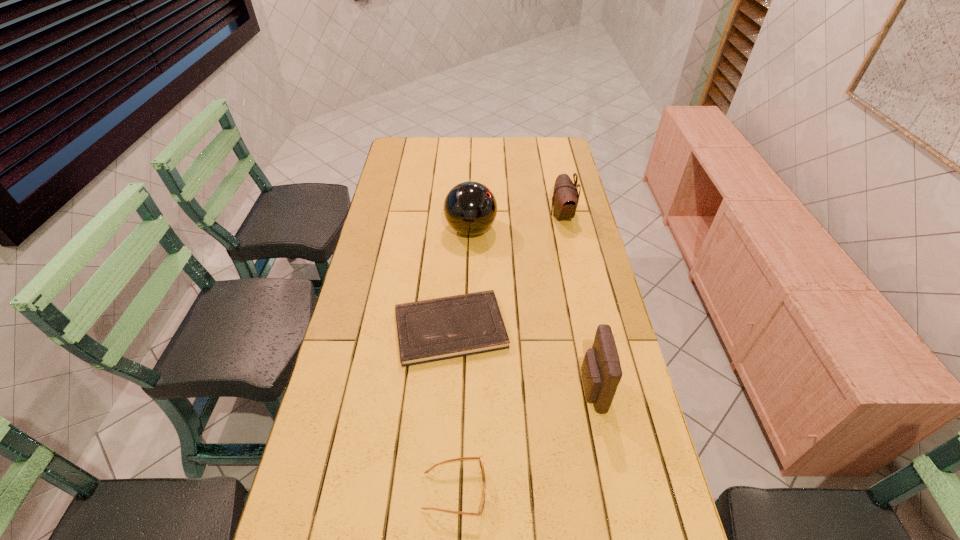
What are the coordinates of `empty space between the farther pouch and the bowling ball` in the screenshot? It's located at pos(516,222).

Image resolution: width=960 pixels, height=540 pixels. What are the coordinates of `vacant space in between the bowling ball and the farther pouch` in the screenshot? It's located at (516, 222).

Where is `free area in between the farther pouch and the bowling ball`? This screenshot has height=540, width=960. free area in between the farther pouch and the bowling ball is located at coordinates (516, 222).

Locate an element on the screen. The height and width of the screenshot is (540, 960). free space between the shortest object and the farther pouch is located at coordinates (506, 272).

Identify the location of free space between the bowling ball and the nearest object. (463, 360).

The width and height of the screenshot is (960, 540). I want to click on vacant area that lies between the nearer pouch and the farther pouch, so click(577, 302).

This screenshot has width=960, height=540. I want to click on free space between the nearer pouch and the farther pouch, so [577, 302].

You are a GUI agent. You are given a task and a screenshot of the screen. Output one action in this format:
    pyautogui.click(x=<x>, y=<y>)
    Task: Click on the unoccupied position between the bowling ball and the nearer pouch
    
    Given the screenshot: What is the action you would take?
    pyautogui.click(x=531, y=309)

I want to click on vacant area that lies between the paperback book and the nearer pouch, so click(x=521, y=359).

You are a GUI agent. You are given a task and a screenshot of the screen. Output one action in this format:
    pyautogui.click(x=<x>, y=<y>)
    Task: Click on the object that ranks as the fourth closest to the farther pouch
    
    Given the screenshot: What is the action you would take?
    pyautogui.click(x=464, y=458)